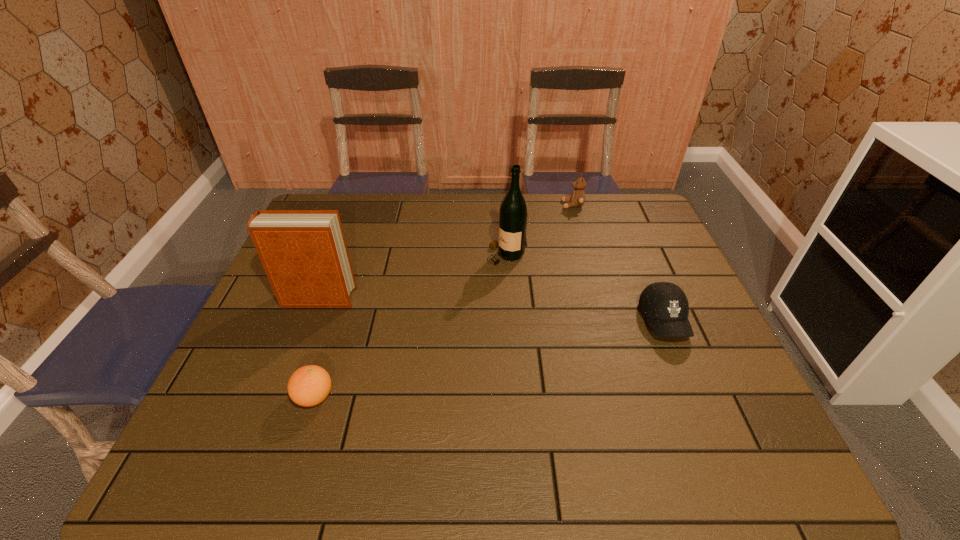
Where is `vacant space at the left edge of the desktop`? This screenshot has width=960, height=540. vacant space at the left edge of the desktop is located at coordinates (235, 412).

This screenshot has height=540, width=960. In the image, there is a desktop. Identify the location of vacant space at the right edge. (668, 266).

Identify the location of vacant space at the far left corner. The width and height of the screenshot is (960, 540). (343, 214).

In the image, there is a desktop. Where is `vacant area at the near left corner`? vacant area at the near left corner is located at coordinates (185, 459).

In the image, there is a desktop. Identify the location of free space at the far right corner. Image resolution: width=960 pixels, height=540 pixels. (627, 226).

Image resolution: width=960 pixels, height=540 pixels. I want to click on vacant region at the near right corner of the desktop, so point(719,463).

Locate an element on the screen. This screenshot has height=540, width=960. vacant space that is in between the nearest object and the farthest object is located at coordinates (444, 301).

I want to click on free space between the rightmost object and the fourth object from left to right, so click(x=618, y=263).

The height and width of the screenshot is (540, 960). In order to click on vacant space in between the rightmost object and the teddy bear in this screenshot , I will do `click(618, 263)`.

The height and width of the screenshot is (540, 960). Find the location of `free area in between the teddy bear and the hardback book`. free area in between the teddy bear and the hardback book is located at coordinates (445, 252).